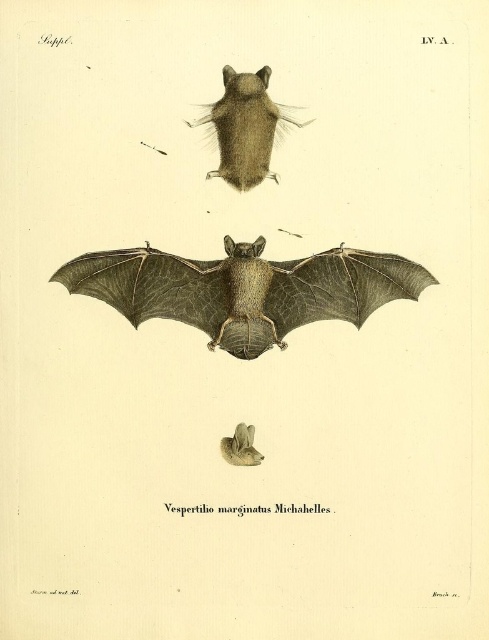
Question: Does brown leather bat at center appear over furry brown bat at upper center?

Choices:
 (A) yes
 (B) no

Answer: (B)

Question: Can you confirm if furry brown bat at upper center is positioned to the left of gray fur bat at center?

Choices:
 (A) yes
 (B) no

Answer: (B)

Question: Which is nearer to the brown leather bat at center?

Choices:
 (A) furry brown bat at upper center
 (B) gray fur bat at center

Answer: (A)

Question: Can you confirm if furry brown bat at upper center is thinner than gray fur bat at center?

Choices:
 (A) yes
 (B) no

Answer: (B)

Question: Which object is the farthest from the brown leather bat at center?

Choices:
 (A) furry brown bat at upper center
 (B) gray fur bat at center

Answer: (B)

Question: Among these objects, which one is nearest to the camera?

Choices:
 (A) brown leather bat at center
 (B) furry brown bat at upper center

Answer: (A)